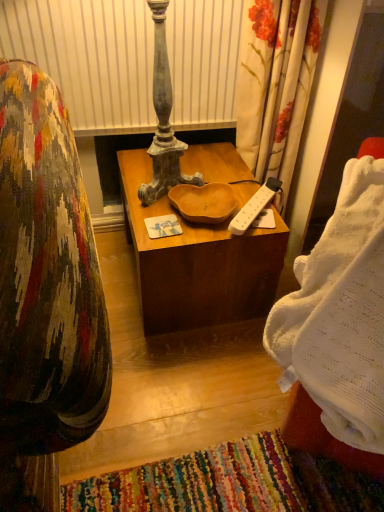
Image resolution: width=384 pixels, height=512 pixels. Describe the element at coordinates (197, 262) in the screenshot. I see `wooden at center` at that location.

Identify the location of white plastic power strip at center. This screenshot has height=512, width=384. (254, 206).

Where is `wooden at center`? This screenshot has height=512, width=384. wooden at center is located at coordinates (197, 262).

How much distance is there between wooden at center and white knitted blanket at right?

23.23 inches.

At what (x,y) coordinates should I click in order to perform the action: click on blanket in front of the wooden at center. Please return your answer as a coordinate pair (x, y). The image size is (384, 512). Looking at the image, I should click on (340, 314).

Does wooden at center touch white knitted blanket at right?

No, wooden at center is not in contact with white knitted blanket at right.

Is the position of wooden at center more distant than that of white knitted blanket at right?

Yes, wooden at center is further from the viewer.

Find the location of a particular element. Image resolution: width=384 pixels, height=512 pixels. desk on the left of the white plastic power strip at center is located at coordinates (197, 262).

Is white plastic power strip at center oriented away from wooden at center?

white plastic power strip at center is not turned away from wooden at center.

From a real-world perspective, is white plastic power strip at center physically below wooden at center?

No, from a real-world perspective, white plastic power strip at center is not below wooden at center.

Is white plastic power strip at center directly adjacent to wooden at center?

No, white plastic power strip at center is not with wooden at center.

Measure the distance from white knitted blanket at right to white plastic power strip at center.

white knitted blanket at right and white plastic power strip at center are 21.11 inches apart from each other.

Which is closer to the camera, (338, 290) or (246, 227)?

The point (338, 290) is more forward.

Is white knitted blanket at right located outside white plastic power strip at center?

Absolutely, white knitted blanket at right is external to white plastic power strip at center.

Is white knitted blanket at right positioned with its back to white plastic power strip at center?

No, white knitted blanket at right is not facing away from white plastic power strip at center.

Is white plastic power strip at center in contact with white knitted blanket at right?

They are not placed beside each other.

From a real-world perspective, who is located lower, white plastic power strip at center or white knitted blanket at right?

white plastic power strip at center is physically lower.

Could you tell me if white plastic power strip at center is facing white knitted blanket at right?

No, white plastic power strip at center is not turned towards white knitted blanket at right.

Is point (310, 305) closer or farther from the camera than point (252, 266)?

Point (310, 305).

Between white knitted blanket at right and wooden at center, which one has larger width?

Wider between the two is white knitted blanket at right.

From a real-world perspective, which is physically above, white knitted blanket at right or wooden at center?

white knitted blanket at right, from a real-world perspective.

Locate an element on the screen. The image size is (384, 512). blanket to the right of wooden at center is located at coordinates (340, 314).

In the scene shown: Would you say wooden at center is inside or outside white plastic power strip at center?

The correct answer is: outside.

Can you confirm if wooden at center is smaller than white plastic power strip at center?

Actually, wooden at center might be larger than white plastic power strip at center.

Where is `desk above the white knitted blanket at right (from the image's perspective)`? This screenshot has height=512, width=384. desk above the white knitted blanket at right (from the image's perspective) is located at coordinates (197, 262).

Where is `remote control above the wooden at center (from a real-world perspective)`? The width and height of the screenshot is (384, 512). remote control above the wooden at center (from a real-world perspective) is located at coordinates (254, 206).

Which object lies nearer to the anchor point wooden at center, white knitted blanket at right or white plastic power strip at center?

white plastic power strip at center.

Looking at the image, which one is located further to wooden at center, white plastic power strip at center or white knitted blanket at right?

Among the two, white knitted blanket at right is located further to wooden at center.

In the scene shown: From the image, which object appears to be farther from white plastic power strip at center, white knitted blanket at right or wooden at center?

Among the two, white knitted blanket at right is located further to white plastic power strip at center.

From the image, which object appears to be nearer to white knitted blanket at right, wooden at center or white plastic power strip at center?

Answer: Among the two, white plastic power strip at center is located nearer to white knitted blanket at right.

Based on the photo, estimate the real-world distances between objects in this image. Which object is closer to white knitted blanket at right, white plastic power strip at center or wooden at center?

white plastic power strip at center.

Considering their positions, is wooden at center positioned further to white plastic power strip at center than white knitted blanket at right?

Based on the image, white knitted blanket at right appears to be further to white plastic power strip at center.

Locate an element on the screen. desk between white knitted blanket at right and white plastic power strip at center along the z-axis is located at coordinates (197, 262).